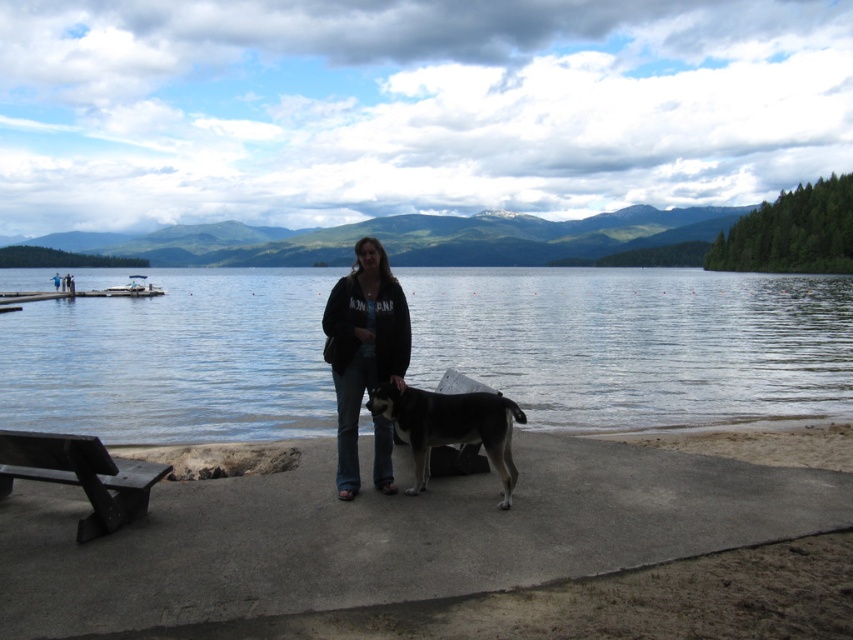
Is clear water at center thinner than black and white fur dog at center?

No, clear water at center is not thinner than black and white fur dog at center.

Is the position of clear water at center less distant than that of black and white fur dog at center?

No, it is not.

Does point (567, 422) come in front of point (496, 429)?

No, it is behind (496, 429).

Find the location of `clear water at center`. clear water at center is located at coordinates (637, 340).

Does point (341, 604) come farther from viewer compared to point (381, 353)?

That is False.

Find the location of a particular element. The image size is (853, 640). sandy concrete at lower center is located at coordinates click(x=389, y=536).

In order to click on sandy concrete at lower center in this screenshot , I will do `click(389, 536)`.

Measure the distance between point (328, 355) and camera.

Point (328, 355) and camera are 6.31 meters apart from each other.

Measure the distance between dark gray fleece jacket at center and camera.

dark gray fleece jacket at center and camera are 6.11 meters apart.

Where is `dark gray fleece jacket at center`? dark gray fleece jacket at center is located at coordinates (363, 346).